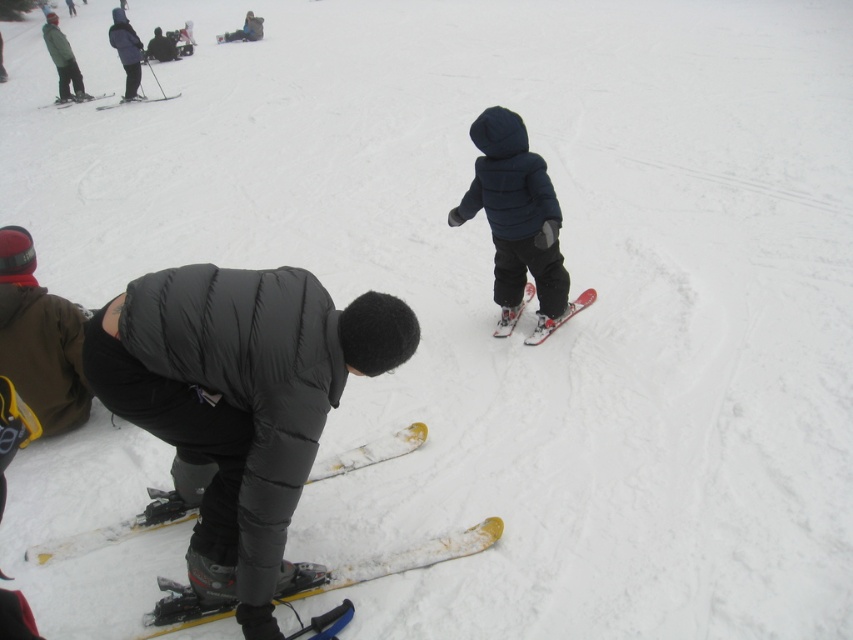
Which is below, yellow matte ski at upper left or yellow plastic ski at upper left?

yellow matte ski at upper left is below.

From the picture: Who is taller, yellow matte ski at upper left or yellow plastic ski at upper left?

Standing taller between the two is yellow plastic ski at upper left.

What do you see at coordinates (136, 100) in the screenshot? I see `yellow matte ski at upper left` at bounding box center [136, 100].

You are a GUI agent. You are given a task and a screenshot of the screen. Output one action in this format:
    pyautogui.click(x=<x>, y=<y>)
    Task: Click on the yellow matte ski at upper left
    
    Given the screenshot: What is the action you would take?
    pyautogui.click(x=136, y=100)

Is the position of matte black snowboard at lower center less distant than that of dark blue puffy jacket at center?

Yes, it is in front of dark blue puffy jacket at center.

Between matte black snowboard at lower center and dark blue puffy jacket at center, which one has less height?

With less height is matte black snowboard at lower center.

Is point (213, 376) positioned in front of point (496, 266)?

Yes, point (213, 376) is closer to viewer.

Find the location of a particular element. The height and width of the screenshot is (640, 853). matte black snowboard at lower center is located at coordinates (241, 401).

In the scene shown: Who is taller, yellow matte skis at lower center or yellow matte ski at upper left?

With more height is yellow matte ski at upper left.

Is point (53, 548) farther from viewer compared to point (173, 97)?

No, (53, 548) is in front of (173, 97).

Locate an element on the screen. Image resolution: width=853 pixels, height=640 pixels. yellow matte skis at lower center is located at coordinates (115, 529).